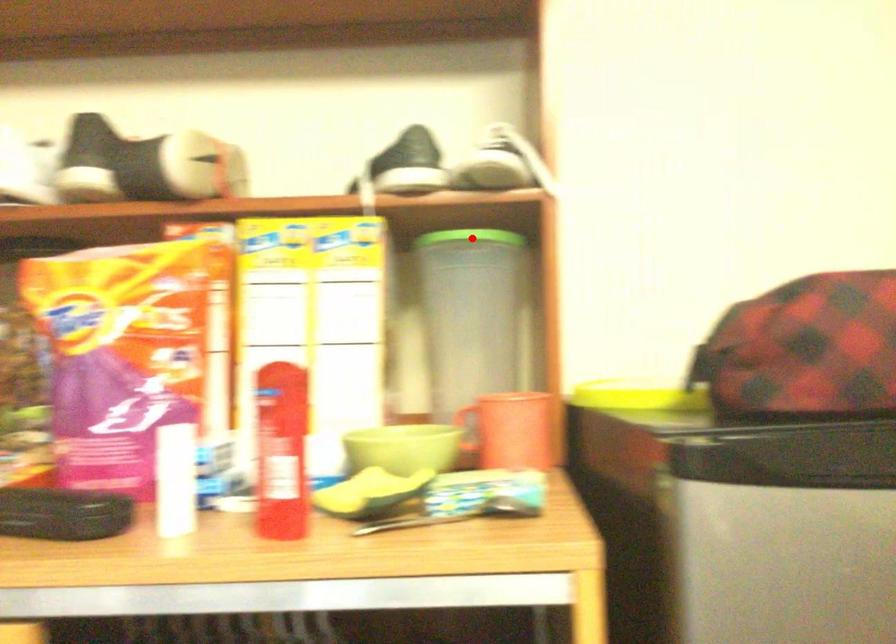
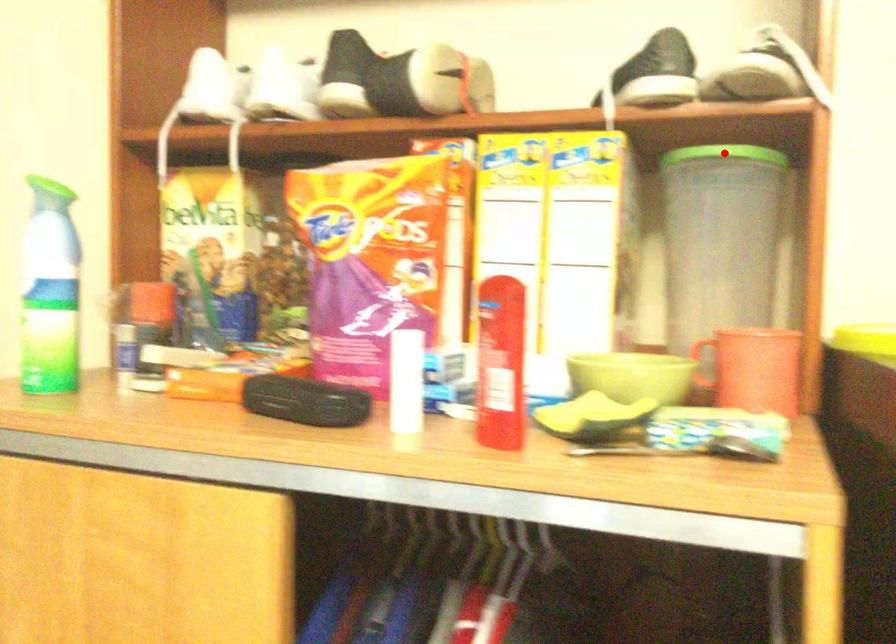
I am providing you with two images of the same scene from different viewpoints. A red point is marked on the first image and another point is marked on the second image. Do the highlighted points in image1 and image2 indicate the same real-world spot?

Yes